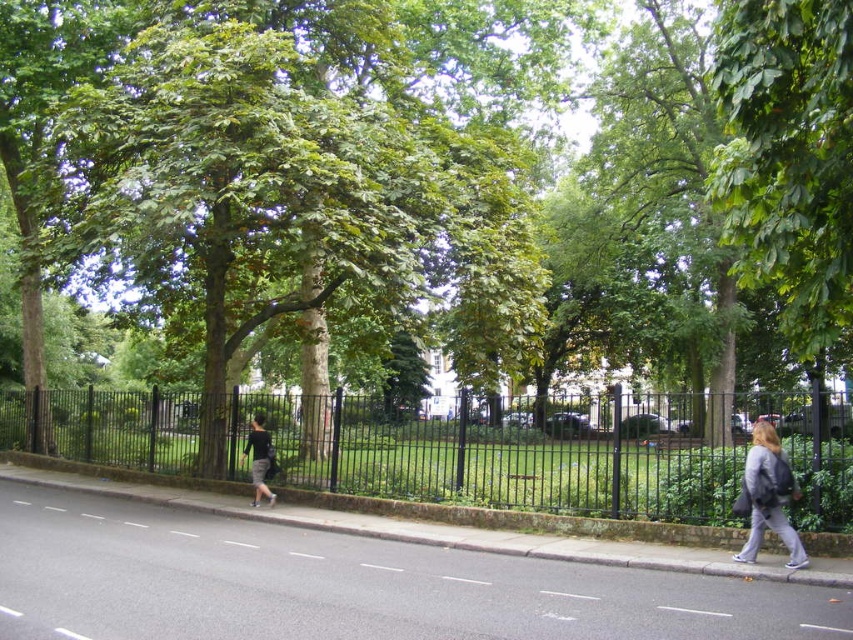
Does black metal fence at center have a greater width compared to dark gray fabric pants at center?

Correct, the width of black metal fence at center exceeds that of dark gray fabric pants at center.

Is point (717, 508) more distant than point (262, 420)?

No, (717, 508) is in front of (262, 420).

I want to click on black metal fence at center, so click(x=503, y=456).

Does point (398, 323) come in front of point (263, 442)?

No, (398, 323) is behind (263, 442).

Does green leafy tree at center appear over dark gray fabric pants at center?

Correct, green leafy tree at center is located above dark gray fabric pants at center.

Who is more distant from viewer, (200, 442) or (268, 445)?

The point (200, 442) is more distant.

Find the location of a particular element. The height and width of the screenshot is (640, 853). green leafy tree at center is located at coordinates [x=444, y=184].

Does black metal fence at center have a greater height compared to gray fabric jacket at lower right?

Yes.

Is black metal fence at center wider than gray fabric jacket at lower right?

Indeed, black metal fence at center has a greater width compared to gray fabric jacket at lower right.

Which is in front, point (134, 428) or point (753, 522)?

Point (753, 522) is in front.

You are a GUI agent. You are given a task and a screenshot of the screen. Output one action in this format:
    pyautogui.click(x=<x>, y=<y>)
    Task: Click on the black metal fence at center
    This screenshot has height=640, width=853.
    Given the screenshot: What is the action you would take?
    pyautogui.click(x=503, y=456)